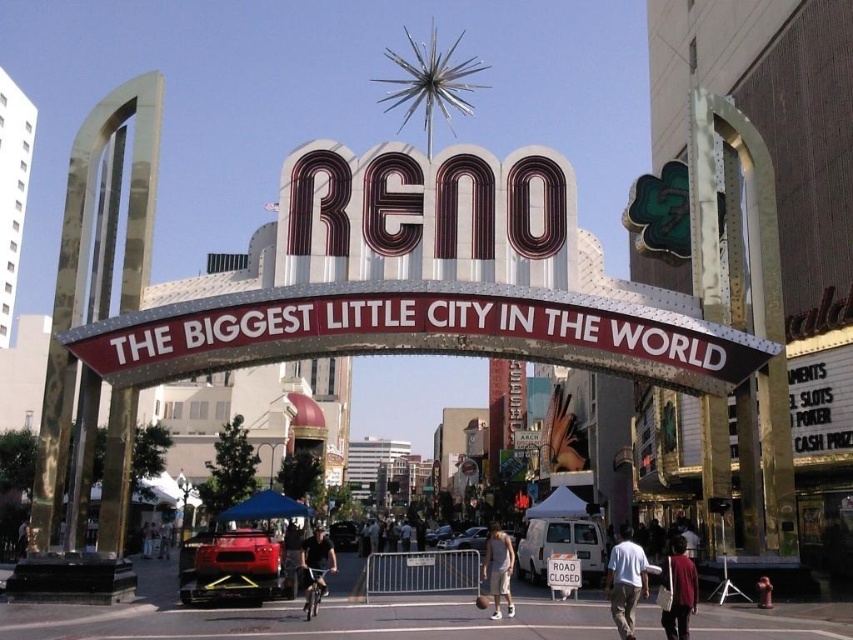
Question: Estimate the real-world distances between objects in this image. Which object is farther from the white cotton shirt at center?

Choices:
 (A) black matte bicycle at center
 (B) light brown fabric shorts at center
 (C) maroon fabric shirt at lower right
 (D) white plastic road sign at center

Answer: (A)

Question: Can you confirm if black matte bicycle at center is smaller than white plastic road sign at center?

Choices:
 (A) no
 (B) yes

Answer: (A)

Question: Which is farther from the black matte bicycle at center?

Choices:
 (A) white plastic road sign at center
 (B) white cotton shirt at center

Answer: (B)

Question: Among these points, which one is nearest to the camera?

Choices:
 (A) (614, 566)
 (B) (509, 605)
 (C) (676, 609)

Answer: (C)

Question: Is white cotton shirt at center below white plastic road sign at center?

Choices:
 (A) yes
 (B) no

Answer: (A)

Question: Can you confirm if maroon fabric shirt at lower right is positioned below black matte bicycle at center?

Choices:
 (A) yes
 (B) no

Answer: (A)